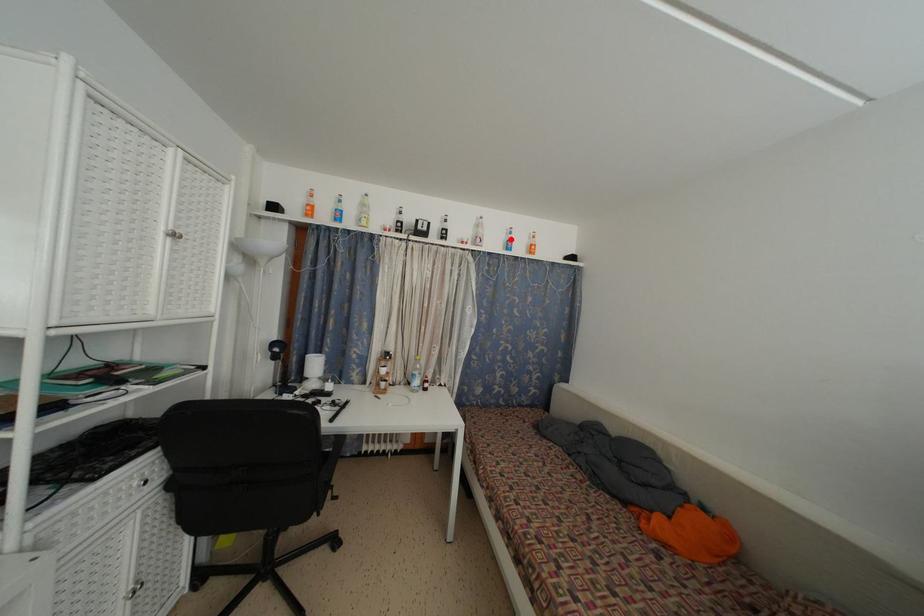
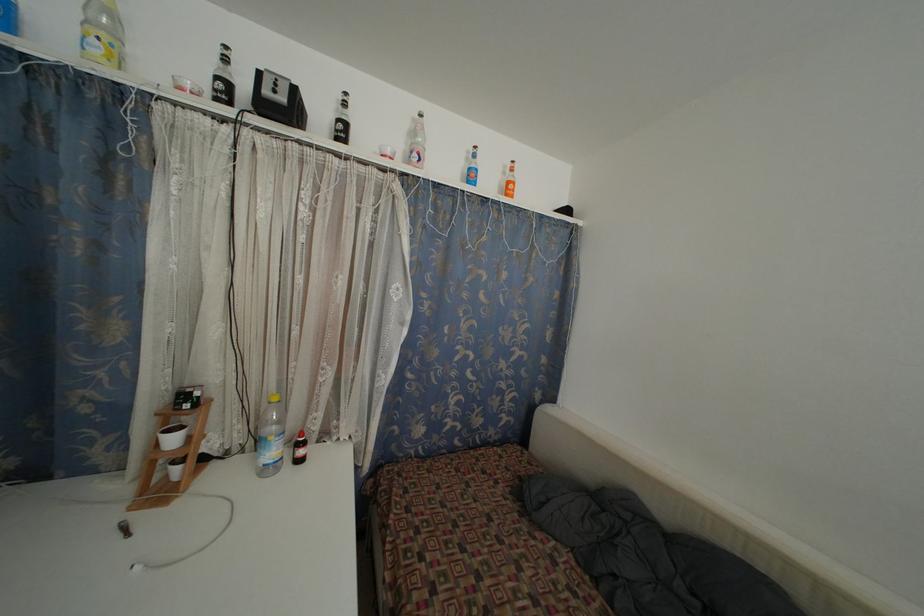
Where in the second image is the point corresponding to the highlighted location from the first image?

(470, 164)